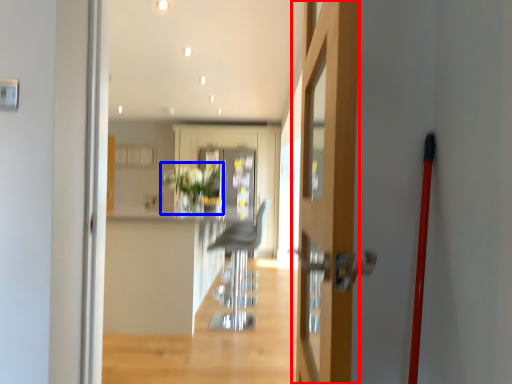
Question: Which point is closer to the camera, door (highlighted by a red box) or plant (highlighted by a blue box)?

Choices:
 (A) door
 (B) plant

Answer: (A)